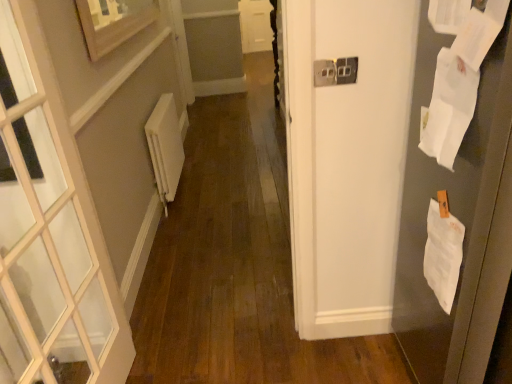
In order to click on unoccupied area in front of white matte radiator at left in this screenshot , I will do `click(192, 221)`.